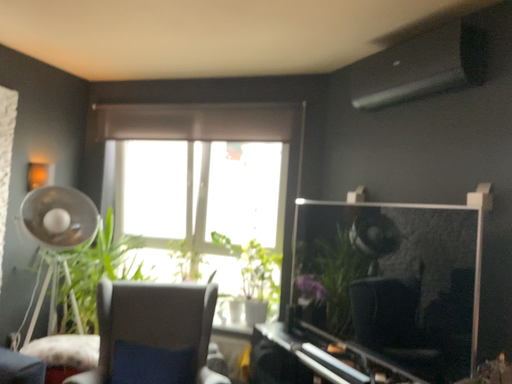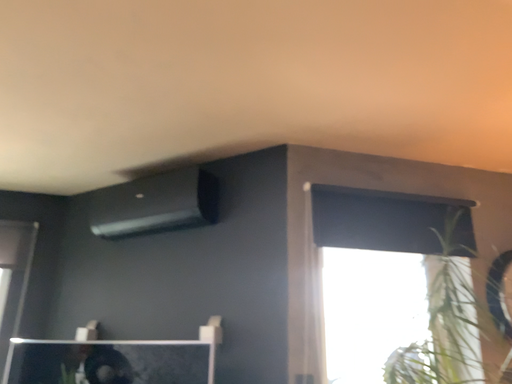
Question: Which way did the camera rotate in the video?

Choices:
 (A) rotated upward
 (B) rotated downward

Answer: (A)